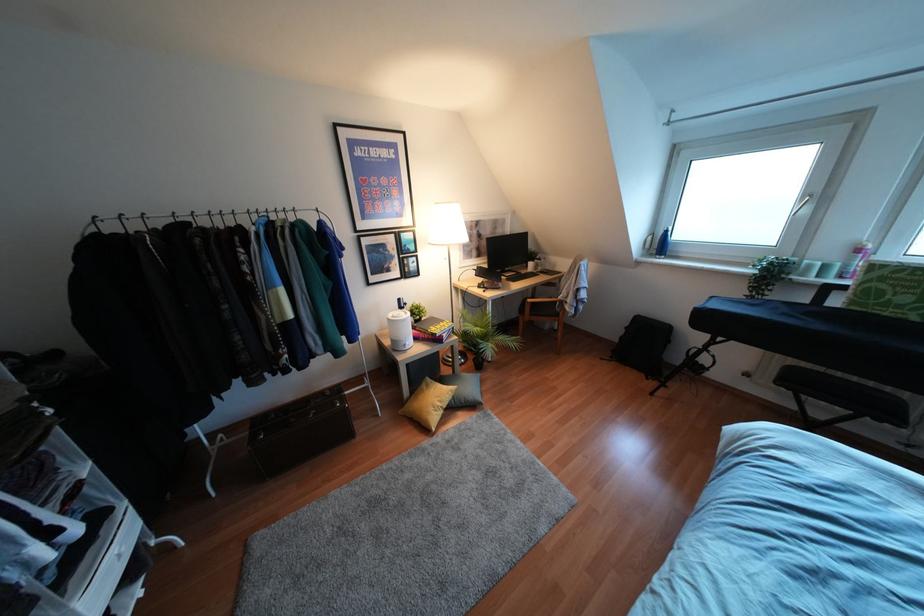
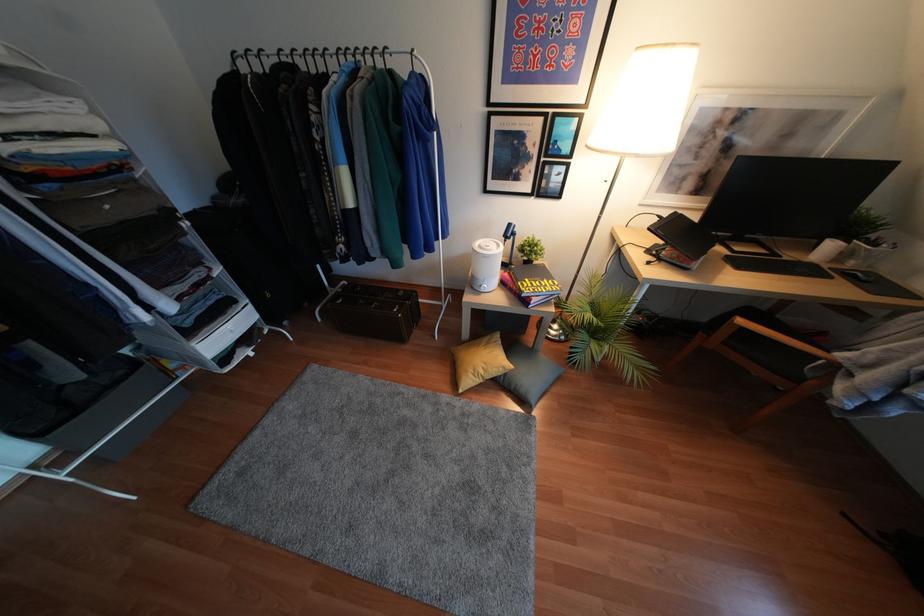
Where in the second image is the point corresponding to point (479, 270) from the first image?

(666, 224)